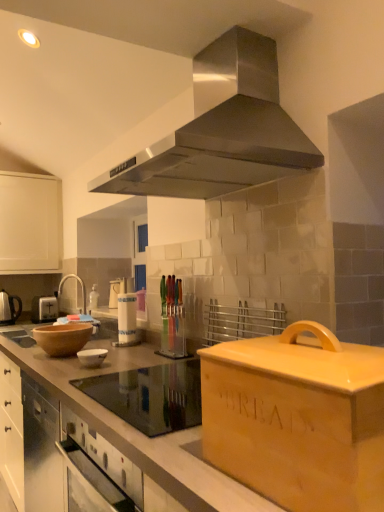
You are a GUI agent. You are given a task and a screenshot of the screen. Output one action in this format:
    pyautogui.click(x=<x>, y=<y>)
    Task: Click on the empty space that is ontop of stainless steel range hood at upper center (from a real-world perspective)
    Image resolution: width=384 pixels, height=512 pixels.
    Given the screenshot: What is the action you would take?
    pos(204,31)